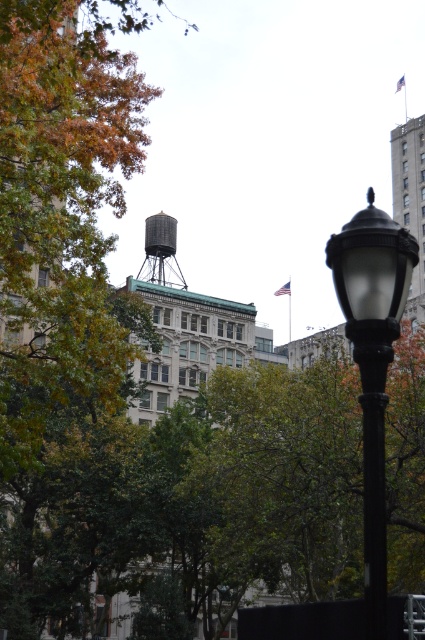
Question: Considering the real-world distances, which object is closest to the black matte street light at center right?

Choices:
 (A) gray concrete building at upper right
 (B) metallic gray water tower at center

Answer: (A)

Question: Does black matte street light at center right have a lesser width compared to metallic gray water tower at center?

Choices:
 (A) no
 (B) yes

Answer: (B)

Question: Which point is farther to the camera?

Choices:
 (A) (411, 141)
 (B) (159, 276)

Answer: (A)

Question: Which of these objects is positioned closest to the gray concrete building at upper right?

Choices:
 (A) black matte street light at center right
 (B) metallic gray water tower at center

Answer: (B)

Question: Can you confirm if black matte street light at center right is bigger than metallic gray water tower at center?

Choices:
 (A) yes
 (B) no

Answer: (B)

Question: Can you confirm if black matte street light at center right is wider than metallic gray water tower at center?

Choices:
 (A) yes
 (B) no

Answer: (B)